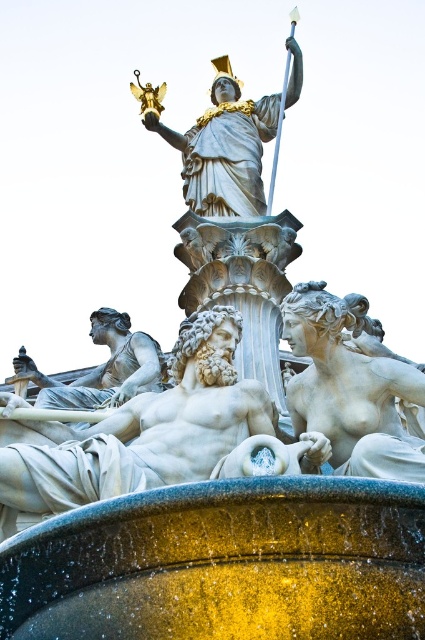
Question: Is white marble statue at center wider than white marble statue at lower left?

Choices:
 (A) yes
 (B) no

Answer: (A)

Question: Which point is farther from the camera taking this photo?

Choices:
 (A) (362, 456)
 (B) (116, 330)
 (C) (269, 131)
 (D) (121, 433)

Answer: (C)

Question: Does polished bronze statue at center have a larger size compared to white marble statue at lower left?

Choices:
 (A) no
 (B) yes

Answer: (B)

Question: Based on their relative distances, which object is farther from the smooth white statue at lower right?

Choices:
 (A) white marble statue at lower left
 (B) polished bronze statue at center

Answer: (B)

Question: Considering the relative positions of smooth white statue at lower right and white marble statue at lower left in the image provided, where is smooth white statue at lower right located with respect to white marble statue at lower left?

Choices:
 (A) above
 (B) below

Answer: (A)

Question: Which object appears farthest from the camera in this image?

Choices:
 (A) white marble statue at lower left
 (B) smooth white statue at lower right
 (C) polished bronze statue at center
 (D) white marble statue at center

Answer: (C)